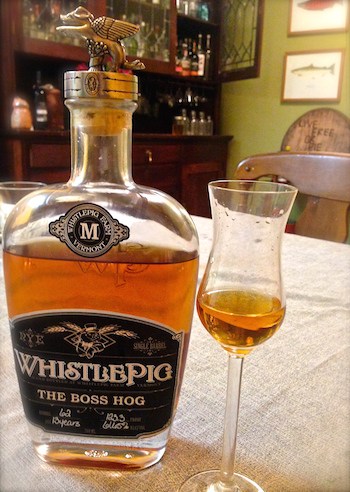
At what (x,y) coordinates should I click in order to perform the action: click on wooden chair back. Please return your answer as a coordinate pair (x, y). Looking at the image, I should click on (321, 231), (329, 181).